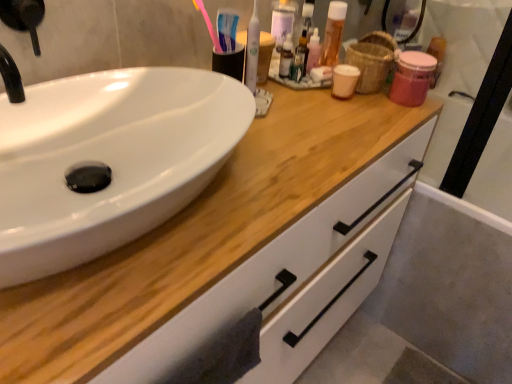
Find the location of a particular element. white plastic toothbrush at upper center, which appears as the second mouthwash when viewed from the right is located at coordinates (252, 50).

What are the coordinates of `brown woven basket at upper right` in the screenshot? It's located at (372, 60).

Where is `pink plastic toothbrush at upper center`? Image resolution: width=512 pixels, height=384 pixels. pink plastic toothbrush at upper center is located at coordinates (208, 25).

From a real-world perspective, is white plastic toothbrush at upper center, which appears as the second mouthwash when viewed from the right, positioned over brown woven basket at upper right based on gravity?

Correct, in the physical world, white plastic toothbrush at upper center, which appears as the second mouthwash when viewed from the right, is higher than brown woven basket at upper right.

Is point (245, 73) closer to viewer compared to point (394, 59)?

Yes, point (245, 73) is in front of point (394, 59).

Can you tell me how much white plastic toothbrush at upper center, which appears as the second mouthwash when viewed from the right, and brown woven basket at upper right differ in facing direction?

white plastic toothbrush at upper center, which appears as the second mouthwash when viewed from the right, and brown woven basket at upper right are facing 21.2 degrees away from each other.

Does white plastic toothbrush at upper center, which appears as the second mouthwash when viewed from the right, touch brown woven basket at upper right?

white plastic toothbrush at upper center, which appears as the second mouthwash when viewed from the right, and brown woven basket at upper right are clearly separated.

Can you tell me how much white plastic toothbrush at upper center, which ranks as the second mouthwash in back-to-front order, and pink plastic toothbrush at upper center differ in facing direction?

There is a 21.2-degree angle between the facing directions of white plastic toothbrush at upper center, which ranks as the second mouthwash in back-to-front order, and pink plastic toothbrush at upper center.

Is white plastic toothbrush at upper center, which appears as the second mouthwash when viewed from the right, at the right side of pink plastic toothbrush at upper center?

Indeed, white plastic toothbrush at upper center, which appears as the second mouthwash when viewed from the right, is positioned on the right side of pink plastic toothbrush at upper center.

Considering the sizes of white plastic toothbrush at upper center, the first mouthwash positioned from the front, and pink plastic toothbrush at upper center in the image, is white plastic toothbrush at upper center, the first mouthwash positioned from the front, taller or shorter than pink plastic toothbrush at upper center?

Clearly, white plastic toothbrush at upper center, the first mouthwash positioned from the front, is taller compared to pink plastic toothbrush at upper center.

From the image's perspective, which object appears higher, white plastic toothbrush at upper center, which appears as the second mouthwash when viewed from the right, or pink plastic toothbrush at upper center?

pink plastic toothbrush at upper center.

Locate an element on the screen. This screenshot has height=384, width=512. mouthwash that is in front of the brown woven basket at upper right is located at coordinates (252, 50).

Are brown woven basket at upper right and white plastic toothbrush at upper center, which appears as the second mouthwash when viewed from the right, located far from each other?

brown woven basket at upper right is near white plastic toothbrush at upper center, which appears as the second mouthwash when viewed from the right, not far away.

Can we say brown woven basket at upper right lies outside white plastic toothbrush at upper center, which appears as the second mouthwash when viewed from the right?

Yes, brown woven basket at upper right is located beyond the bounds of white plastic toothbrush at upper center, which appears as the second mouthwash when viewed from the right.

Which object is more forward, brown woven basket at upper right or white plastic toothbrush at upper center, which ranks as the second mouthwash in back-to-front order?

white plastic toothbrush at upper center, which ranks as the second mouthwash in back-to-front order, is more forward.

Considering the sizes of objects pink plastic toothbrush at upper center and brown woven basket at upper right in the image provided, who is smaller, pink plastic toothbrush at upper center or brown woven basket at upper right?

pink plastic toothbrush at upper center is smaller.

Consider the image. Is pink plastic toothbrush at upper center aimed at brown woven basket at upper right?

No, pink plastic toothbrush at upper center is not oriented towards brown woven basket at upper right.

What's the angular difference between pink plastic toothbrush at upper center and brown woven basket at upper right's facing directions?

There is a 0.000888-degree angle between the facing directions of pink plastic toothbrush at upper center and brown woven basket at upper right.

Which is correct: pink plastic toothbrush at upper center is inside brown woven basket at upper right, or outside of it?

pink plastic toothbrush at upper center is spatially situated outside brown woven basket at upper right.

Which is behind, point (186, 233) or point (362, 60)?

The point (362, 60) is farther.

Can you see wooden cabinet at center touching brown woven basket at upper right?

No.

Where is `basket on the right of wooden cabinet at center`? basket on the right of wooden cabinet at center is located at coordinates (372, 60).

Looking at their sizes, would you say wooden cabinet at center is wider or thinner than brown woven basket at upper right?

In the image, wooden cabinet at center appears to be wider than brown woven basket at upper right.

Is translucent plastic mouthwash at upper center, which is the 2th mouthwash in left-to-right order, beside pink plastic toothbrush at upper center?

translucent plastic mouthwash at upper center, which is the 2th mouthwash in left-to-right order, and pink plastic toothbrush at upper center are not in contact.

From the picture: From their relative heights in the image, would you say translucent plastic mouthwash at upper center, which is counted as the first mouthwash, starting from the right, is taller or shorter than pink plastic toothbrush at upper center?

translucent plastic mouthwash at upper center, which is counted as the first mouthwash, starting from the right, is taller than pink plastic toothbrush at upper center.

Based on the photo, from a real-world perspective, does translucent plastic mouthwash at upper center, which is the 2th mouthwash in left-to-right order, stand above pink plastic toothbrush at upper center?

No, from a real-world perspective, translucent plastic mouthwash at upper center, which is the 2th mouthwash in left-to-right order, is not above pink plastic toothbrush at upper center.

From the picture: How much distance is there between translucent plastic mouthwash at upper center, which is counted as the second mouthwash, starting from the front, and pink plastic toothbrush at upper center?

translucent plastic mouthwash at upper center, which is counted as the second mouthwash, starting from the front, is 12.60 inches from pink plastic toothbrush at upper center.

Is white glossy sink at left not close to white plastic toothbrush at upper center, which ranks as the second mouthwash in back-to-front order?

white glossy sink at left is near white plastic toothbrush at upper center, which ranks as the second mouthwash in back-to-front order, not far away.

From a real-world perspective, which is physically above, white glossy sink at left or white plastic toothbrush at upper center, the 1th mouthwash from the left?

white plastic toothbrush at upper center, the 1th mouthwash from the left.

Is white glossy sink at left facing towards white plastic toothbrush at upper center, the 1th mouthwash from the left?

No.

This screenshot has height=384, width=512. Find the location of `basket behind the white plastic toothbrush at upper center, the first mouthwash positioned from the front`. basket behind the white plastic toothbrush at upper center, the first mouthwash positioned from the front is located at coordinates (372, 60).

Identify the location of mouthwash that is in front of the pink plastic toothbrush at upper center. (252, 50).

When comparing their distances from brown woven basket at upper right, does wooden cabinet at center or white plastic toothbrush at upper center, the first mouthwash positioned from the front, seem further?

Among the two, wooden cabinet at center is located further to brown woven basket at upper right.

Considering their positions, is translucent plastic mouthwash at upper center, positioned as the 1th mouthwash in back-to-front order, positioned closer to brown woven basket at upper right than white plastic toothbrush at upper center, which ranks as the second mouthwash in back-to-front order?

translucent plastic mouthwash at upper center, positioned as the 1th mouthwash in back-to-front order, lies closer to brown woven basket at upper right than the other object.

Considering their positions, is translucent plastic mouthwash at upper center, which is counted as the first mouthwash, starting from the right, positioned closer to pink plastic toothbrush at upper center than wooden cabinet at center?

Based on the image, translucent plastic mouthwash at upper center, which is counted as the first mouthwash, starting from the right, appears to be nearer to pink plastic toothbrush at upper center.

Looking at the image, which one is located further to white plastic toothbrush at upper center, which appears as the second mouthwash when viewed from the right, brown woven basket at upper right or translucent plastic mouthwash at upper center, which is the 2th mouthwash in left-to-right order?

brown woven basket at upper right.

Based on their spatial positions, is pink plastic toothbrush at upper center or translucent plastic mouthwash at upper center, which is counted as the second mouthwash, starting from the front, closer to wooden cabinet at center?

Among the two, pink plastic toothbrush at upper center is located nearer to wooden cabinet at center.

Which object lies further to the anchor point translucent plastic mouthwash at upper center, which is counted as the second mouthwash, starting from the front, white glossy sink at left or pink plastic toothbrush at upper center?

white glossy sink at left is further to translucent plastic mouthwash at upper center, which is counted as the second mouthwash, starting from the front.

Estimate the real-world distances between objects in this image. Which object is further from translucent plastic mouthwash at upper center, positioned as the 1th mouthwash in back-to-front order, wooden cabinet at center or pink plastic toothbrush at upper center?

The object further to translucent plastic mouthwash at upper center, positioned as the 1th mouthwash in back-to-front order, is wooden cabinet at center.

From the image, which object appears to be nearer to brown woven basket at upper right, wooden cabinet at center or white glossy sink at left?

wooden cabinet at center is positioned closer to the anchor brown woven basket at upper right.

You are a GUI agent. You are given a task and a screenshot of the screen. Output one action in this format:
    pyautogui.click(x=<x>, y=<y>)
    Task: Click on the sink between pink plastic toothbrush at upper center and wooden cabinet at center in the up-down direction
    This screenshot has width=512, height=384.
    Given the screenshot: What is the action you would take?
    point(108,160)

The image size is (512, 384). What are the coordinates of `mouthwash between translucent plastic mouthwash at upper center, positioned as the 1th mouthwash in back-to-front order, and wooden cabinet at center vertically` in the screenshot? It's located at (252, 50).

At what (x,y) coordinates should I click in order to perform the action: click on toothbrush between white glossy sink at left and brown woven basket at upper right from front to back. Please return your answer as a coordinate pair (x, y). Image resolution: width=512 pixels, height=384 pixels. Looking at the image, I should click on (208, 25).

This screenshot has height=384, width=512. Identify the location of mouthwash located between pink plastic toothbrush at upper center and translucent plastic mouthwash at upper center, positioned as the 1th mouthwash in back-to-front order, in the left-right direction. (252, 50).